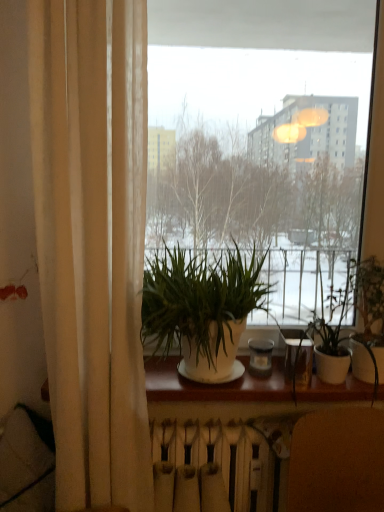
Question: Can you confirm if beige fabric curtain at left is smaller than transparent glass window at center?

Choices:
 (A) no
 (B) yes

Answer: (A)

Question: Can we say beige fabric curtain at left lies outside transparent glass window at center?

Choices:
 (A) no
 (B) yes

Answer: (B)

Question: Is transparent glass window at center at the back of beige fabric curtain at left?

Choices:
 (A) yes
 (B) no

Answer: (B)

Question: Could transparent glass window at center be considered to be inside beige fabric curtain at left?

Choices:
 (A) no
 (B) yes

Answer: (A)

Question: Does beige fabric curtain at left have a lesser height compared to transparent glass window at center?

Choices:
 (A) yes
 (B) no

Answer: (B)

Question: Is beige fabric curtain at left taller than transparent glass window at center?

Choices:
 (A) no
 (B) yes

Answer: (B)

Question: From a real-world perspective, is white matte radiator at lower center located higher than white matte plant pot at center, which is the first houseplant from left to right?

Choices:
 (A) no
 (B) yes

Answer: (A)

Question: Is white matte radiator at lower center turned away from white matte plant pot at center, which is the first houseplant from left to right?

Choices:
 (A) yes
 (B) no

Answer: (B)

Question: From a real-world perspective, is white matte radiator at lower center positioned under white matte plant pot at center, the 2th houseplant when ordered from right to left, based on gravity?

Choices:
 (A) yes
 (B) no

Answer: (A)

Question: Is white matte radiator at lower center bigger than white matte plant pot at center, the 2th houseplant when ordered from right to left?

Choices:
 (A) no
 (B) yes

Answer: (A)

Question: Considering the relative sizes of white matte radiator at lower center and white matte plant pot at center, which is the first houseplant from left to right, in the image provided, is white matte radiator at lower center smaller than white matte plant pot at center, which is the first houseplant from left to right,?

Choices:
 (A) no
 (B) yes

Answer: (B)

Question: Can you confirm if white matte radiator at lower center is thinner than white matte plant pot at center, the 2th houseplant when ordered from right to left?

Choices:
 (A) yes
 (B) no

Answer: (A)